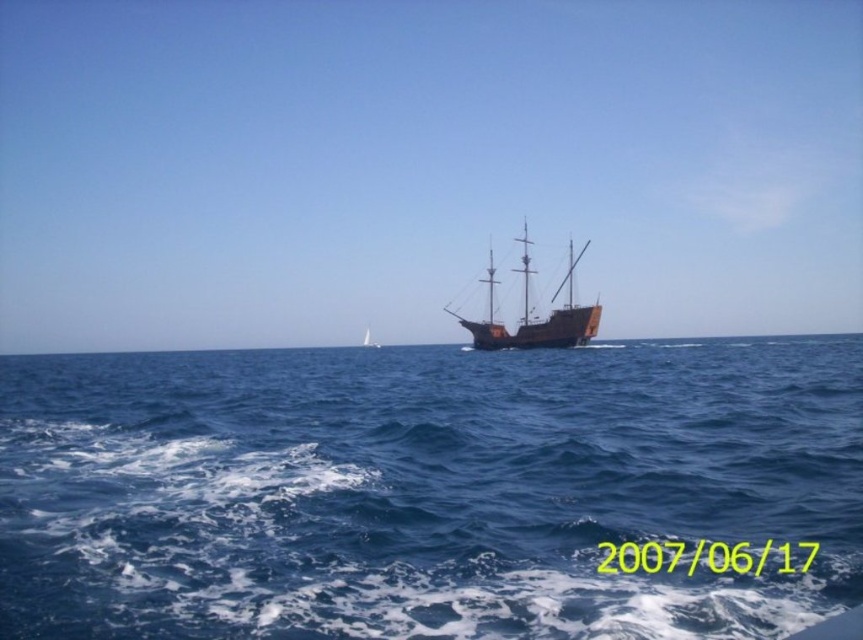
Consider the image. Between blue water at center and wooden ship at center, which one appears on the right side from the viewer's perspective?

wooden ship at center is more to the right.

Locate an element on the screen. This screenshot has height=640, width=863. blue water at center is located at coordinates (423, 490).

Does blue water at center have a larger size compared to brown wooden ship at center?

Indeed, blue water at center has a larger size compared to brown wooden ship at center.

Is the position of blue water at center more distant than that of brown wooden ship at center?

That is False.

Is point (93, 552) farther from camera compared to point (364, 330)?

No, (93, 552) is closer to viewer.

Identify the location of blue water at center. The width and height of the screenshot is (863, 640). (423, 490).

Can you confirm if wooden ship at center is thinner than brown wooden ship at center?

No.

Which of these two, wooden ship at center or brown wooden ship at center, stands shorter?

brown wooden ship at center is shorter.

The width and height of the screenshot is (863, 640). What do you see at coordinates (534, 317) in the screenshot?
I see `wooden ship at center` at bounding box center [534, 317].

Image resolution: width=863 pixels, height=640 pixels. In order to click on wooden ship at center in this screenshot , I will do `click(534, 317)`.